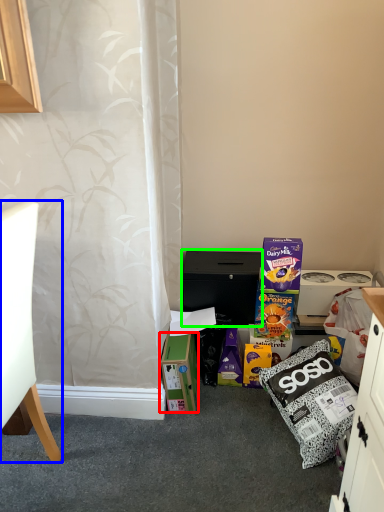
Question: Estimate the real-world distances between objects in this image. Which object is farther from box (highlighted by a red box), chair (highlighted by a blue box) or cabinetry (highlighted by a green box)?

Choices:
 (A) chair
 (B) cabinetry

Answer: (A)